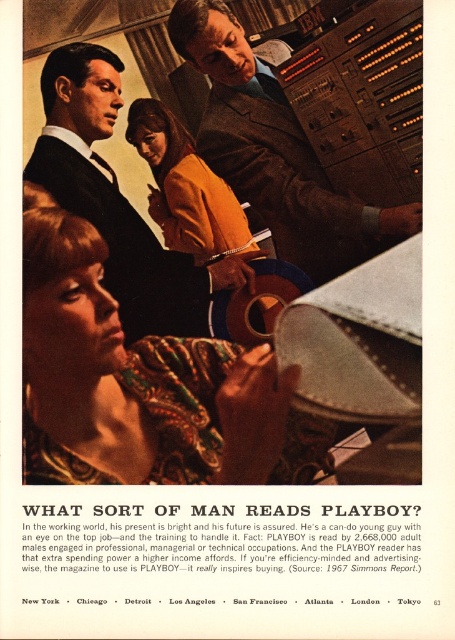
Question: Which object is closer to the camera taking this photo?

Choices:
 (A) orange suede jacket at center
 (B) patterned fabric scarf at lower left
 (C) matte black suit at center
 (D) matte brown suit at center

Answer: (B)

Question: Considering the relative positions of matte brown suit at center and orange suede jacket at center in the image provided, where is matte brown suit at center located with respect to orange suede jacket at center?

Choices:
 (A) right
 (B) left

Answer: (A)

Question: Is matte brown suit at center thinner than matte black suit at center?

Choices:
 (A) yes
 (B) no

Answer: (B)

Question: Which point is farther to the camera?

Choices:
 (A) orange suede jacket at center
 (B) matte black suit at center
 (C) patterned fabric scarf at lower left
 (D) matte brown suit at center

Answer: (A)

Question: Which of these objects is positioned farthest from the matte black suit at center?

Choices:
 (A) orange suede jacket at center
 (B) patterned fabric scarf at lower left
 (C) matte brown suit at center

Answer: (B)

Question: Does matte brown suit at center appear over matte black suit at center?

Choices:
 (A) yes
 (B) no

Answer: (A)